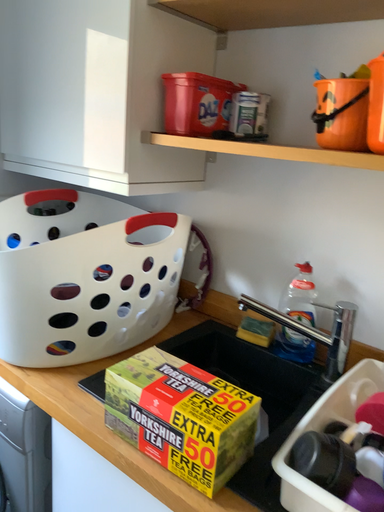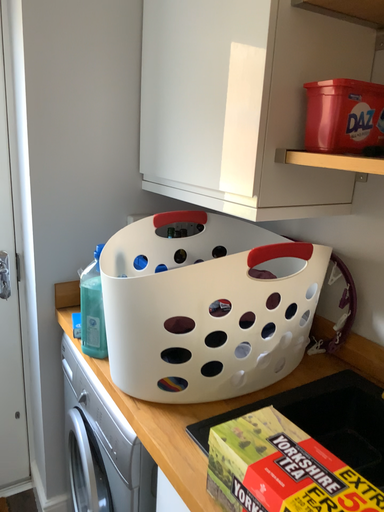
Question: How did the camera likely rotate when shooting the video?

Choices:
 (A) rotated right
 (B) rotated left

Answer: (B)